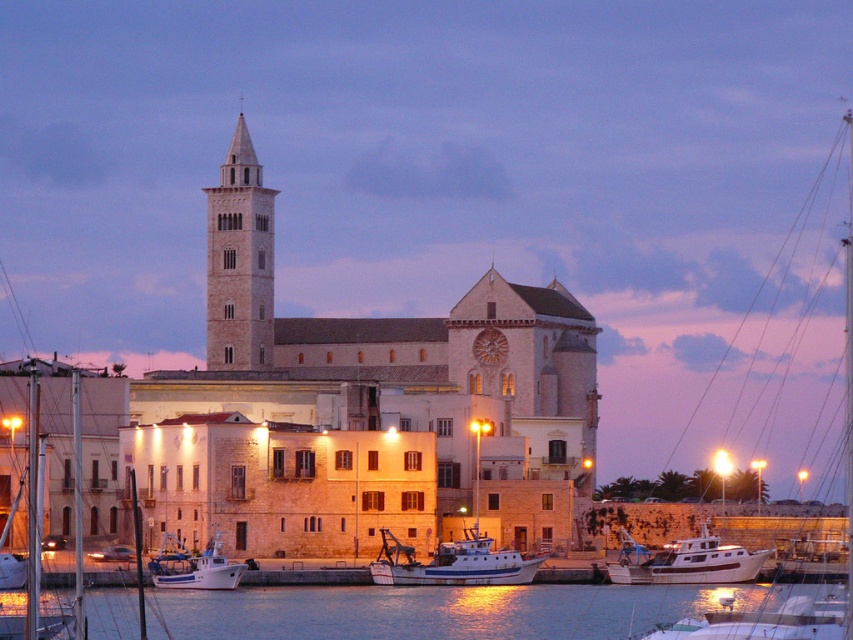
Is white matte boat at center behind white matte boat at lower right?

No, it is in front of white matte boat at lower right.

Is point (531, 573) closer to viewer compared to point (619, 531)?

Yes, it is in front of point (619, 531).

Image resolution: width=853 pixels, height=640 pixels. In order to click on white matte boat at center in this screenshot , I will do `click(453, 563)`.

Which is more to the left, light beige stone bell tower at center or white matte boat at lower right?

Positioned to the left is light beige stone bell tower at center.

Can you confirm if light beige stone bell tower at center is wider than white matte boat at lower right?

Yes.

Between point (242, 273) and point (721, 566), which one is positioned in front?

Point (721, 566)

The image size is (853, 640). Identify the location of light beige stone bell tower at center. (239, 260).

Who is higher up, light beige stone bell tower at center or white matte boat at center?

light beige stone bell tower at center is higher up.

Is light beige stone bell tower at center below white matte boat at center?

Incorrect, light beige stone bell tower at center is not positioned below white matte boat at center.

Who is more forward, (242, 348) or (442, 552)?

Point (442, 552)

Identify the location of light beige stone bell tower at center. (239, 260).